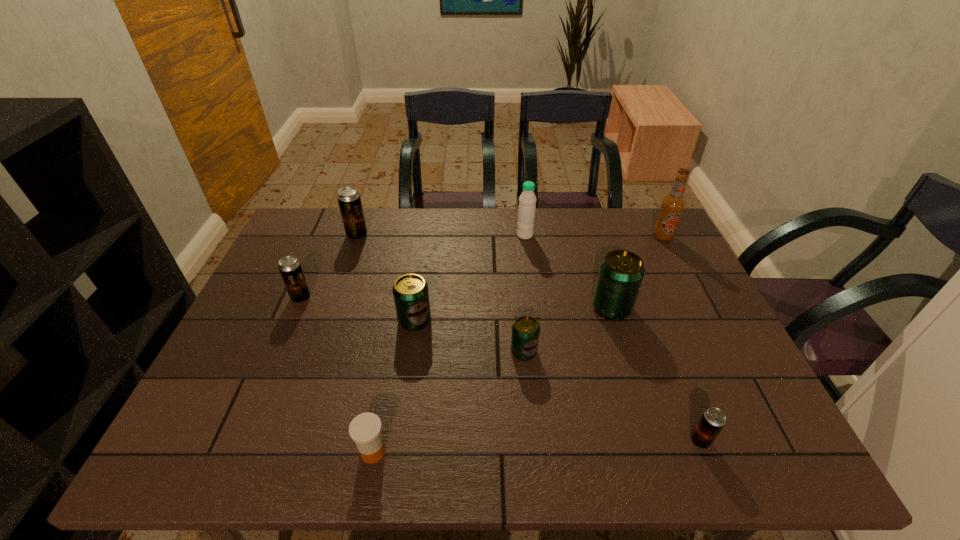
The image size is (960, 540). What are the coordinates of `vacant space located 0.100m on the right of the leftmost object` in the screenshot? It's located at (347, 298).

Locate an element on the screen. The width and height of the screenshot is (960, 540). vacant space located 0.090m on the back of the second biggest green beer can is located at coordinates (420, 286).

Find the location of a particular element. The height and width of the screenshot is (540, 960). free space located 0.160m on the front of the fourth beer can from left to right is located at coordinates (530, 423).

Where is `vacant region located 0.110m on the right of the smallest black beer can`? vacant region located 0.110m on the right of the smallest black beer can is located at coordinates (763, 441).

Where is `free space located 0.090m on the label of the orange medicine`? The width and height of the screenshot is (960, 540). free space located 0.090m on the label of the orange medicine is located at coordinates (432, 451).

Where is `beer bottle that is at the far edge`? beer bottle that is at the far edge is located at coordinates (672, 206).

Identify the location of water bottle at the far edge. The height and width of the screenshot is (540, 960). (527, 201).

This screenshot has height=540, width=960. I want to click on beer can located in the far edge section of the desktop, so click(x=349, y=200).

Locate an element on the screen. beer can that is at the near edge is located at coordinates (713, 419).

What are the coordinates of `medicine situated at the near edge` in the screenshot? It's located at (365, 429).